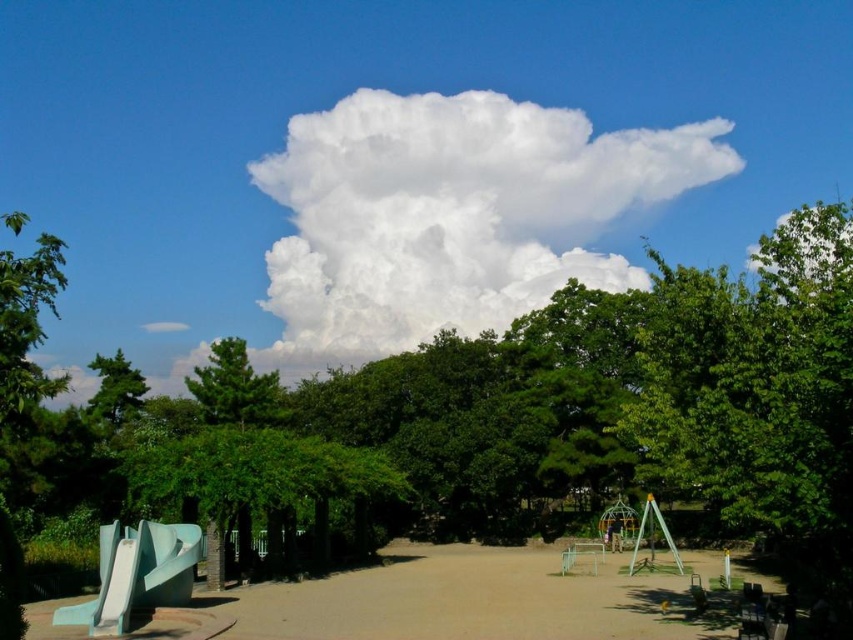
You are standing in the park and want to know how far the point at coordinates [637,154] is from you. Can you determine the distance?

The point at coordinates [637,154] is 199.67 meters away from you.

You are standing in the park and want to walk from the point at coordinates point (x=428, y=474) to the point at coordinates point (x=228, y=614). Which direction should you move relative to your current position?

You should move towards the bottom right direction because point (x=228, y=614) is closer to the camera than point (x=428, y=474), indicating it is located lower and to the right in the image.